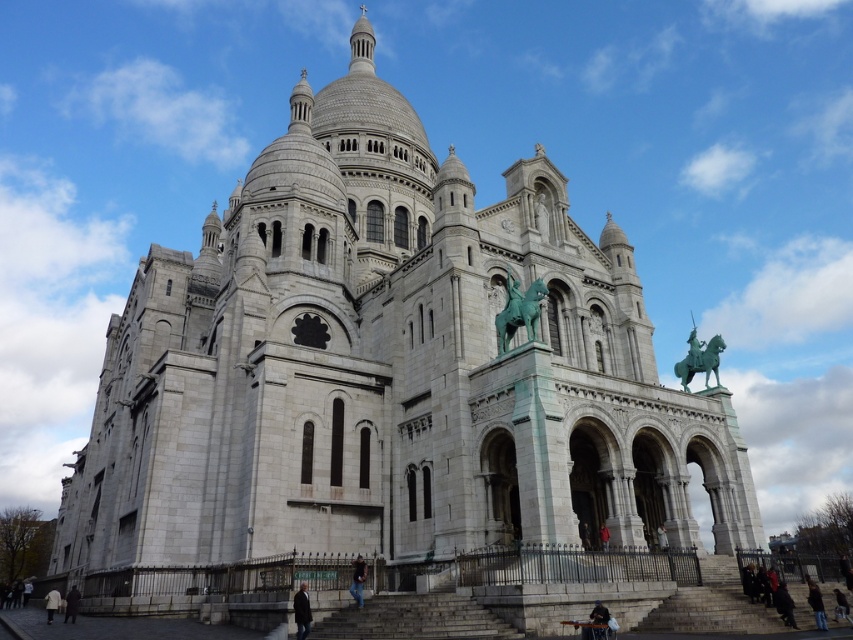
You are standing at the entrance of the Basilica of the Sacred Heart of Paris and notice a green patina metal horse at upper center. What are the coordinates of this horse relative to the basilica?

The green patina metal horse at upper center is located at coordinates point (518, 310) relative to the basilica.

You are standing at point (537, 289). The basilica is 120 meters long. Can you walk from your current position to the other end of the basilica without crossing the 60 meter mark?

The distance between your current position and the other end of the basilica is 59.95 meters, so you can walk to the other end without crossing the 60 meter mark.

You are an art student analyzing the Basilica of the Sacred Heart of Paris. You notice two statues on the facade. The first is a green patina metal horse at upper center, and the second is a green patina statue at upper right. Which of these two statues is wider?

The green patina statue at upper right is wider than the green patina metal horse at upper center.